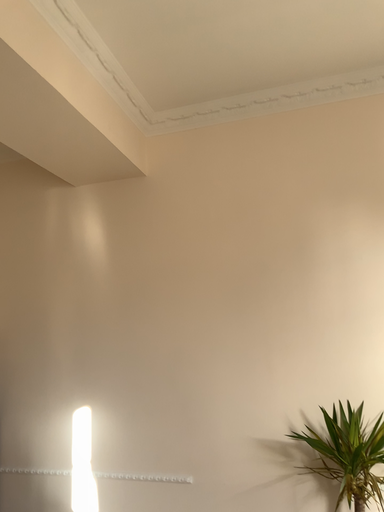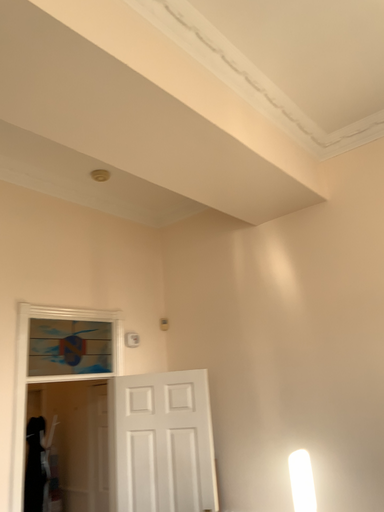
Question: Which way did the camera rotate in the video?

Choices:
 (A) rotated right
 (B) rotated left

Answer: (B)